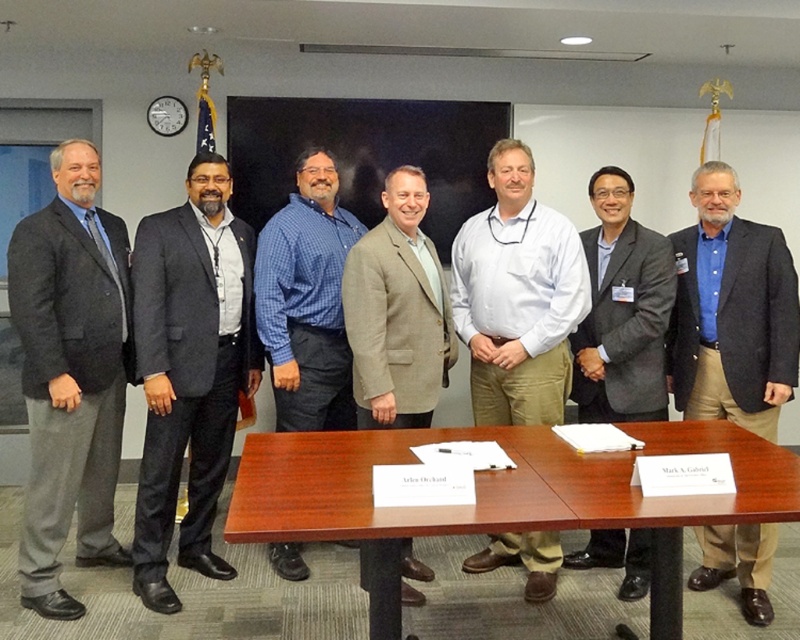
Question: Which of these objects is positioned farthest from the tan textured blazer at center?

Choices:
 (A) dark gray suit at left
 (B) blue checkered shirt at center
 (C) dark gray suit at center
 (D) white cotton shirt at center

Answer: (A)

Question: Does brown wood table at center come behind dark gray suit at left?

Choices:
 (A) yes
 (B) no

Answer: (B)

Question: Does brown leather shoes at center appear on the right side of tan textured blazer at center?

Choices:
 (A) yes
 (B) no

Answer: (A)

Question: Which of the following is the farthest from the observer?

Choices:
 (A) brown wood table at center
 (B) tan textured blazer at center
 (C) blue checkered shirt at center

Answer: (C)

Question: Which of the following is the closest to the observer?

Choices:
 (A) brown wood table at center
 (B) dark gray suit at center
 (C) blue checkered shirt at center
 (D) brown leather shoes at center

Answer: (A)

Question: Is brown leather shoes at center above white cotton shirt at center?

Choices:
 (A) yes
 (B) no

Answer: (B)